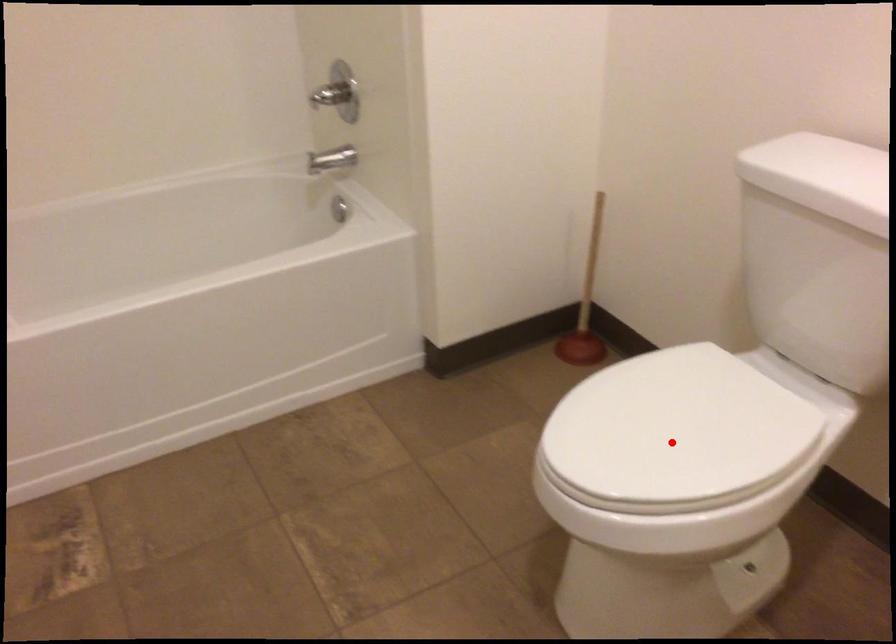
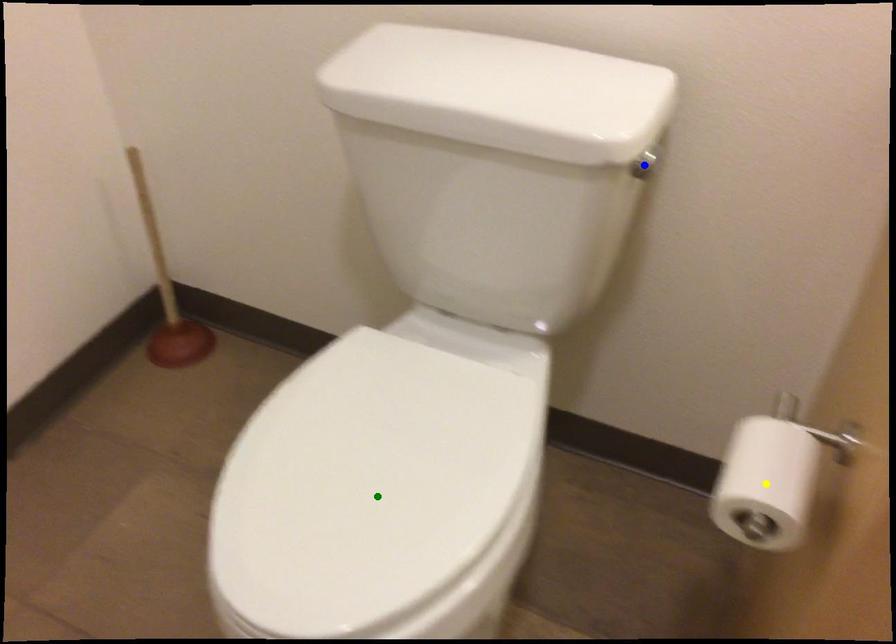
Question: I am providing you with two images of the same scene from different viewpoints. A red point is marked on the first image. You are given multiple points on the second image. In image 2, which mark is for the same physical point as the one in image 1?

Choices:
 (A) yellow point
 (B) blue point
 (C) green point

Answer: (C)